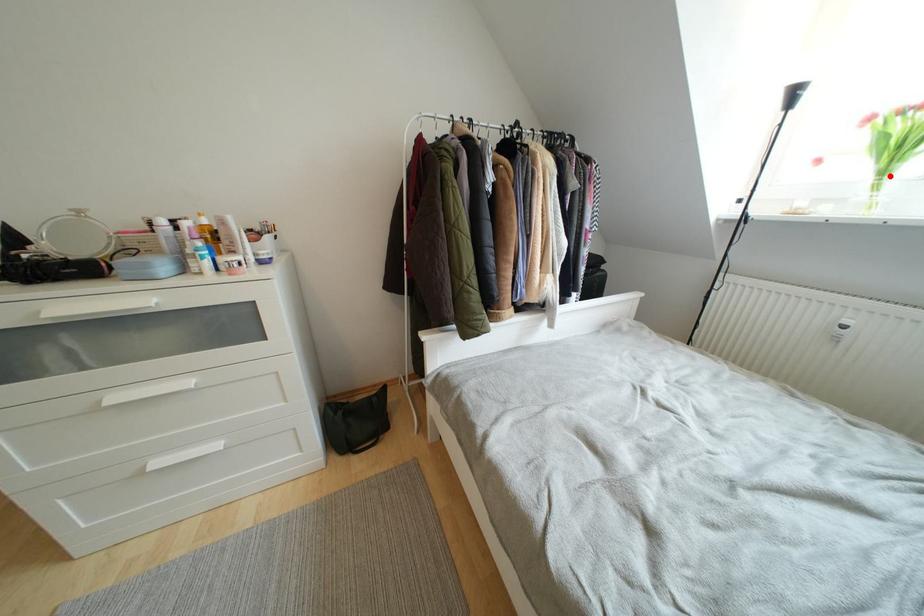
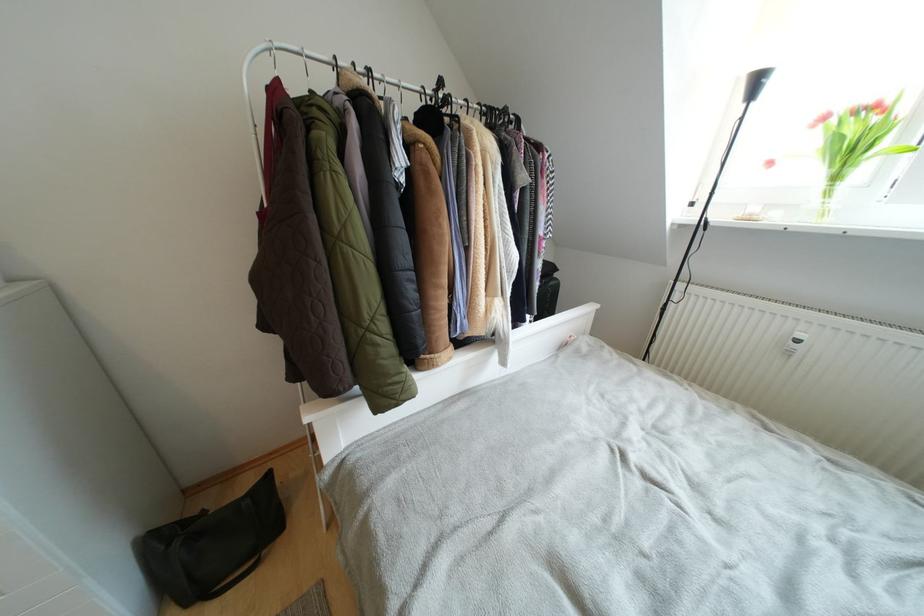
In the second image, find the point that corresponds to the highlighted location in the first image.

(840, 182)